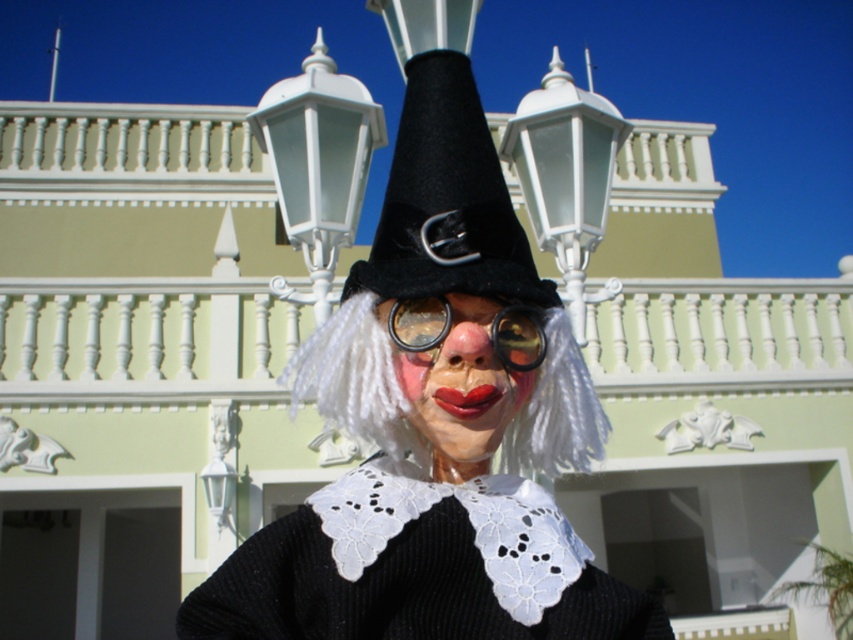
Question: Where is matte plastic clown face at center located in relation to pink matte nose at center in the image?

Choices:
 (A) above
 (B) below

Answer: (B)

Question: Which point is farther to the camera?

Choices:
 (A) matte plastic clown face at center
 (B) black felt hat at center
 (C) white glossy streetlight at upper center
 (D) shiny black goggles at center

Answer: (C)

Question: Among these objects, which one is nearest to the camera?

Choices:
 (A) shiny black goggles at center
 (B) pink matte nose at center
 (C) white glossy streetlight at upper center
 (D) matte plastic clown face at center

Answer: (B)

Question: Among these points, which one is nearest to the camera?

Choices:
 (A) (302, 387)
 (B) (556, 266)
 (C) (384, 262)
 (D) (492, 348)

Answer: (D)

Question: Observing the image, what is the correct spatial positioning of white glossy streetlight at upper center in reference to pink matte nose at center?

Choices:
 (A) above
 (B) below

Answer: (A)

Question: Does black felt hat at center have a lesser width compared to white glossy streetlight at upper center?

Choices:
 (A) yes
 (B) no

Answer: (A)